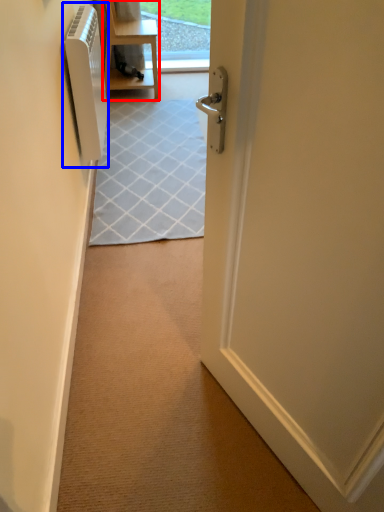
Question: Which object is further to the camera taking this photo, furniture (highlighted by a red box) or air conditioner (highlighted by a blue box)?

Choices:
 (A) furniture
 (B) air conditioner

Answer: (A)